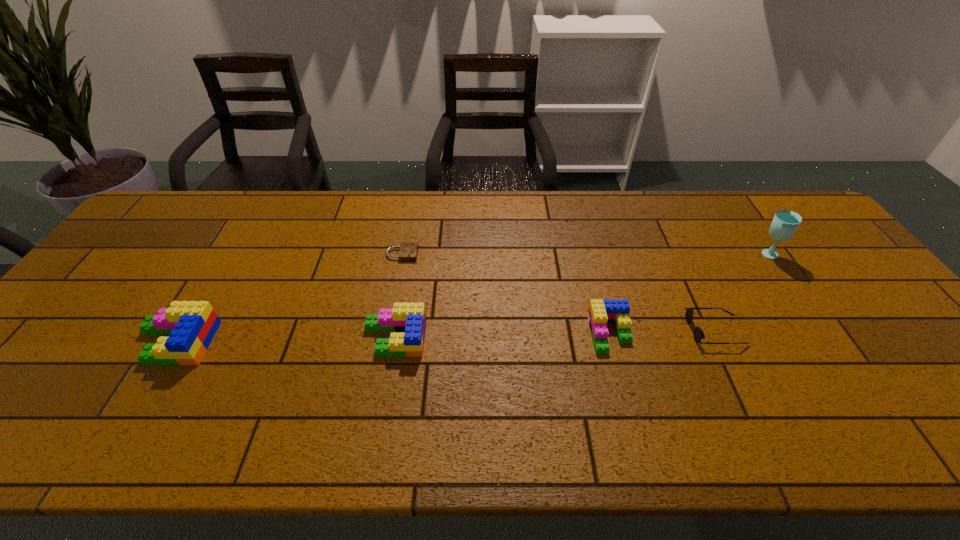
This screenshot has height=540, width=960. I want to click on free space at the left edge, so click(140, 237).

In the image, there is a desktop. Find the location of `vacant space at the right edge`. vacant space at the right edge is located at coordinates (879, 296).

The width and height of the screenshot is (960, 540). Identify the location of vacant space that is in between the fifth object from left to right and the second Lego from left to right. (555, 334).

You are a GUI agent. You are given a task and a screenshot of the screen. Output one action in this format:
    pyautogui.click(x=<x>, y=<y>)
    Task: Click on the vacant region between the second object from right to left and the rightmost object
    
    Given the screenshot: What is the action you would take?
    pyautogui.click(x=741, y=292)

At what (x,y) coordinates should I click in order to perform the action: click on vacant region between the shortest Lego and the rightmost object. Please return your answer as a coordinate pair (x, y). Looking at the image, I should click on (688, 293).

Locate an element on the screen. Image resolution: width=960 pixels, height=540 pixels. vacant space in between the shortest object and the leftmost Lego is located at coordinates (289, 298).

You are a GUI agent. You are given a task and a screenshot of the screen. Output one action in this format:
    pyautogui.click(x=<x>, y=<y>)
    Task: Click on the free point between the shortest Lego and the second shortest object
    This screenshot has height=540, width=960.
    Given the screenshot: What is the action you would take?
    pyautogui.click(x=662, y=332)

Where is `vacant area between the leftmost object and the shortest object`? vacant area between the leftmost object and the shortest object is located at coordinates (289, 298).

Locate an element on the screen. The height and width of the screenshot is (540, 960). free space between the second tallest Lego and the fourth object from left to right is located at coordinates (502, 336).

Find the location of a particular element. The height and width of the screenshot is (540, 960). free point between the padlock and the shortest Lego is located at coordinates (506, 294).